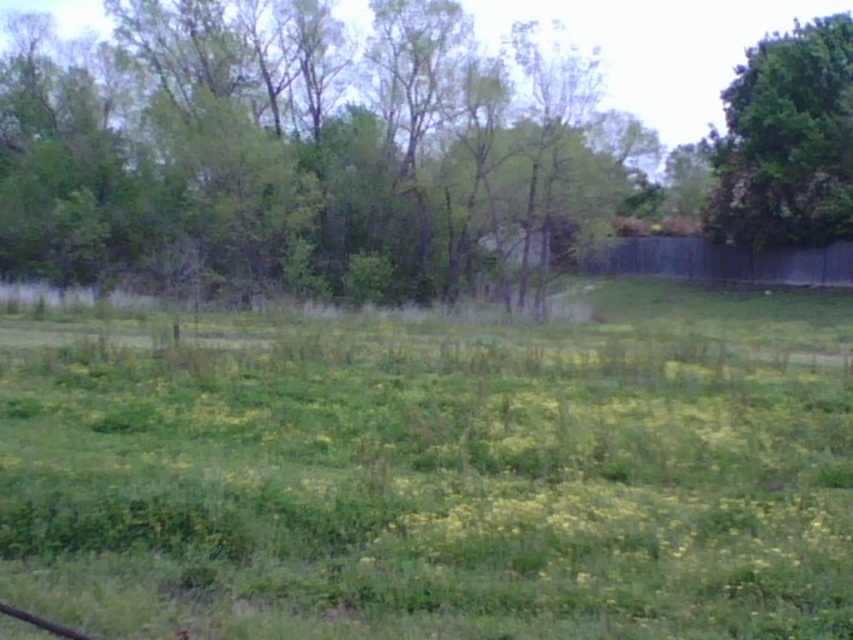
Question: Does green grassy field at center appear over green leafy tree at upper right?

Choices:
 (A) yes
 (B) no

Answer: (B)

Question: Among these points, which one is farthest from the camera?

Choices:
 (A) (384, 93)
 (B) (766, 44)

Answer: (B)

Question: Based on their relative distances, which object is farther from the green leafy tree at upper center?

Choices:
 (A) green grassy field at center
 (B) green leafy tree at upper right

Answer: (A)

Question: Is green leafy tree at upper center thinner than green leafy tree at upper right?

Choices:
 (A) yes
 (B) no

Answer: (B)

Question: Can you confirm if green grassy field at center is positioned above green leafy tree at upper center?

Choices:
 (A) yes
 (B) no

Answer: (B)

Question: Which of the following is the farthest from the observer?

Choices:
 (A) green leafy tree at upper right
 (B) green leafy tree at upper center

Answer: (A)